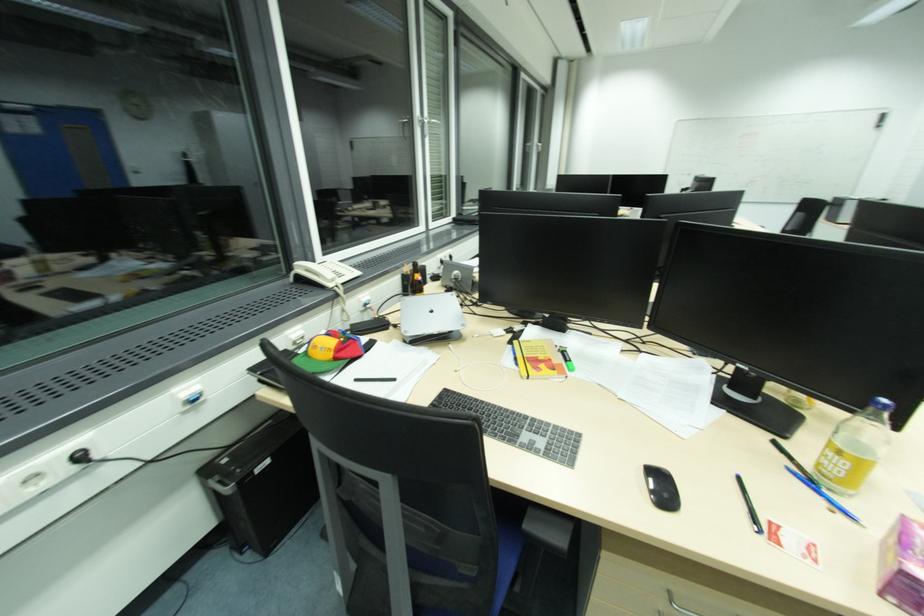
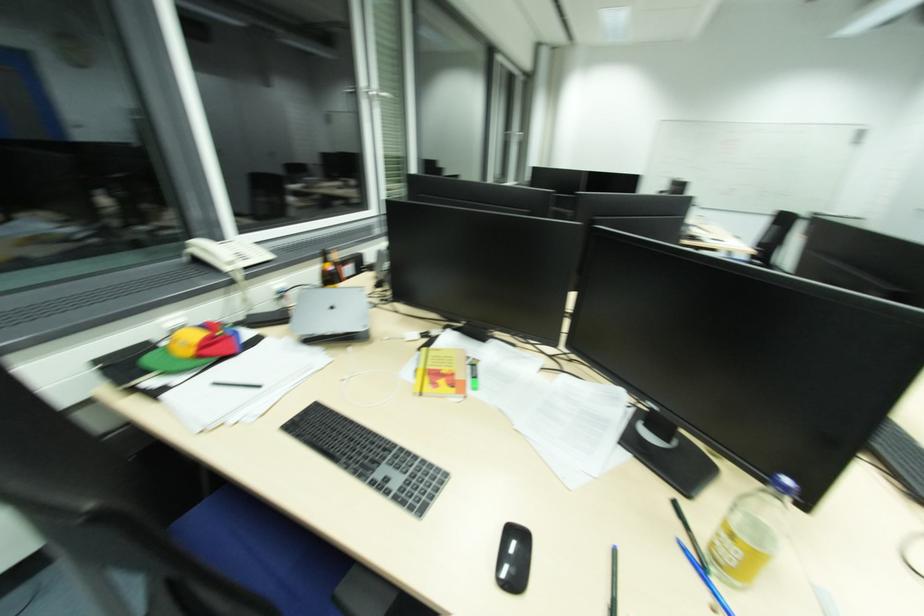
Locate, in the second image, the point that corresponds to pixel 333 286 in the first image.

(231, 270)